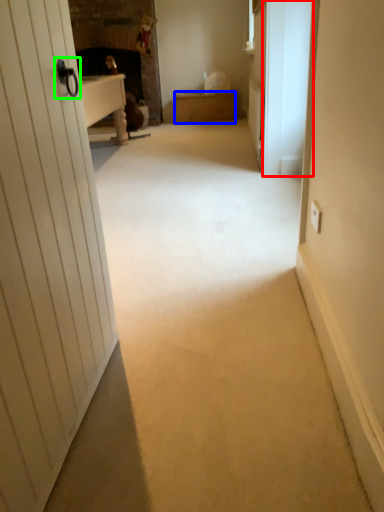
Question: Estimate the real-world distances between objects in this image. Which object is farther from screen door (highlighted by a red box), furniture (highlighted by a blue box) or door handle (highlighted by a green box)?

Choices:
 (A) furniture
 (B) door handle

Answer: (A)